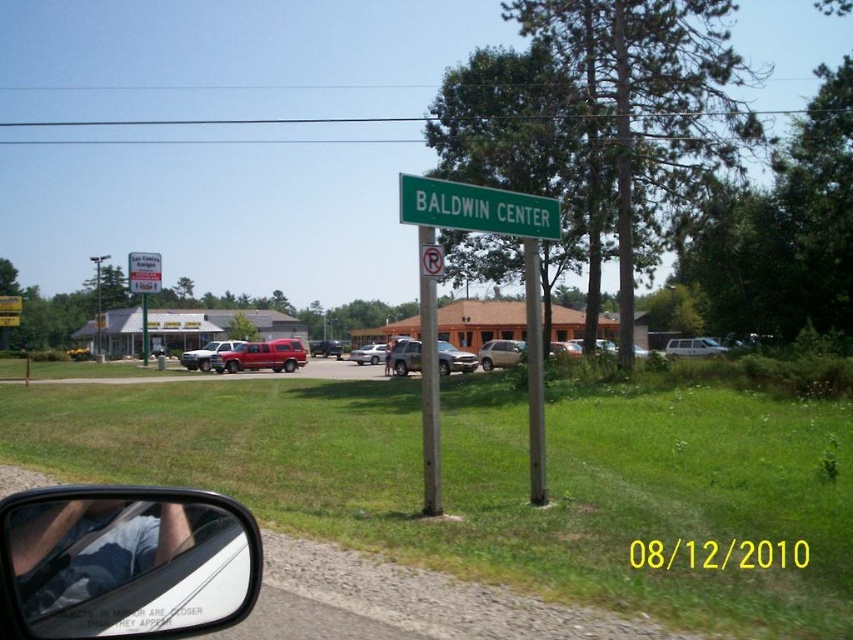
Question: Which object is positioned farthest from the green metallic pole at center?

Choices:
 (A) white plastic sign at upper center
 (B) matte silver truck at center
 (C) matte red truck at center
 (D) silver metallic sedan at center

Answer: (D)

Question: Does matte silver suv at center appear on the left side of silver metallic sedan at center?

Choices:
 (A) yes
 (B) no

Answer: (B)

Question: Can you confirm if green plastic street sign at upper center is bigger than white plastic sign at upper center?

Choices:
 (A) no
 (B) yes

Answer: (B)

Question: Which of the following is the closest to the observer?

Choices:
 (A) (199, 371)
 (B) (361, 349)
 (C) (142, 284)
 (D) (144, 320)

Answer: (A)

Question: Based on their relative distances, which object is farther from the matte silver truck at center?

Choices:
 (A) metallic red suv at center
 (B) white plastic sign at upper center
 (C) green plastic sign at center

Answer: (C)

Question: In this image, where is silver metallic van at center located relative to silver metallic sedan at center?

Choices:
 (A) below
 (B) above

Answer: (B)